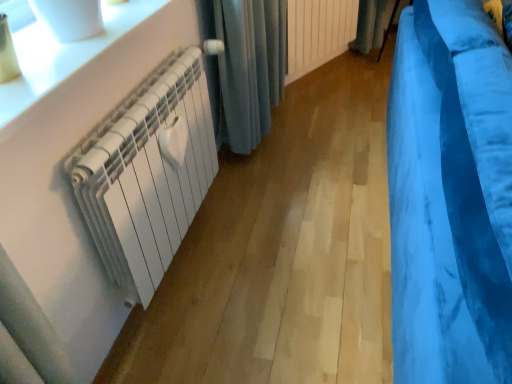
Question: Is blue velvet curtain at upper right, positioned as the 1th curtain in top-to-bottom order, wider or thinner than white glossy radiator at upper left?

Choices:
 (A) thin
 (B) wide

Answer: (A)

Question: In terms of size, does blue velvet curtain at upper right, positioned as the 1th curtain in top-to-bottom order, appear bigger or smaller than white glossy radiator at upper left?

Choices:
 (A) big
 (B) small

Answer: (A)

Question: Which object is the farthest from the white matte radiator at left, placed as the 1th radiator when sorted from left to right?

Choices:
 (A) white glossy radiator at upper left
 (B) white matte radiator at center, the second radiator when ordered from left to right
 (C) blue velvet curtain at upper right, which is the second curtain in front-to-back order
 (D) velvet blue curtain at right, which is the 1th curtain from front to back

Answer: (C)

Question: Based on their relative distances, which object is farther from the white matte radiator at left, which appears as the first radiator when ordered from the bottom?

Choices:
 (A) blue velvet curtain at upper right, the second curtain in the bottom-to-top sequence
 (B) white glossy radiator at upper left
 (C) velvet blue curtain at right, which appears as the first curtain when ordered from the bottom
 (D) white matte radiator at center, acting as the first radiator starting from the back

Answer: (A)